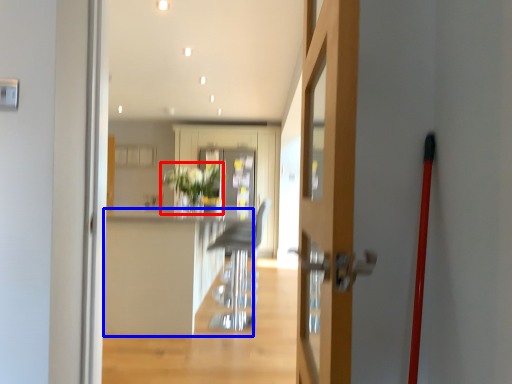
Question: Which object appears closest to the camera in this image, plant (highlighted by a red box) or counter top (highlighted by a blue box)?

Choices:
 (A) plant
 (B) counter top

Answer: (B)